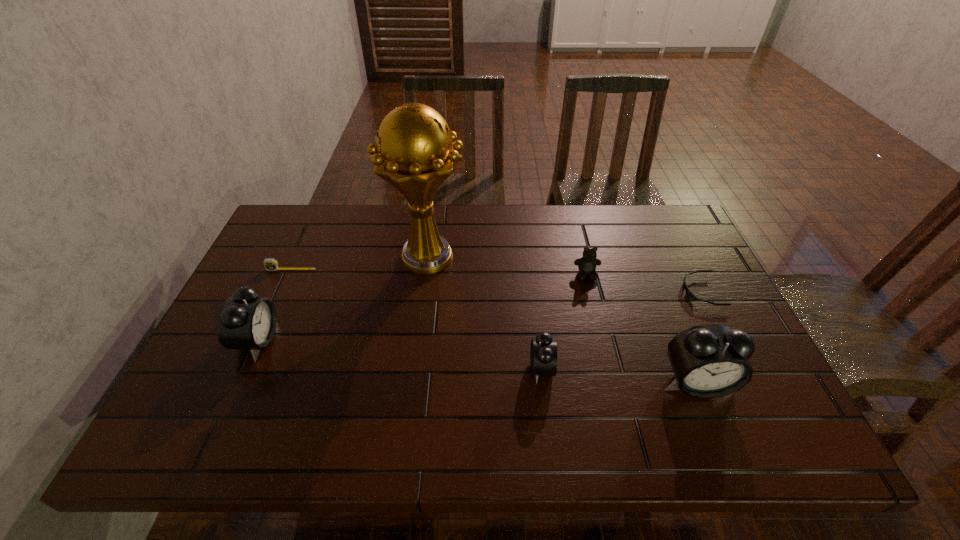
To make them evenly spaced by inserting another alarm_clock among them, please locate a vacant spot for this new alarm_clock. Please provide its 2D coordinates. Your answer should be formatted as a tuple, i.e. [(x, y)], where the tuple contains the x and y coordinates of a point satisfying the conditions above.

[(396, 354)]